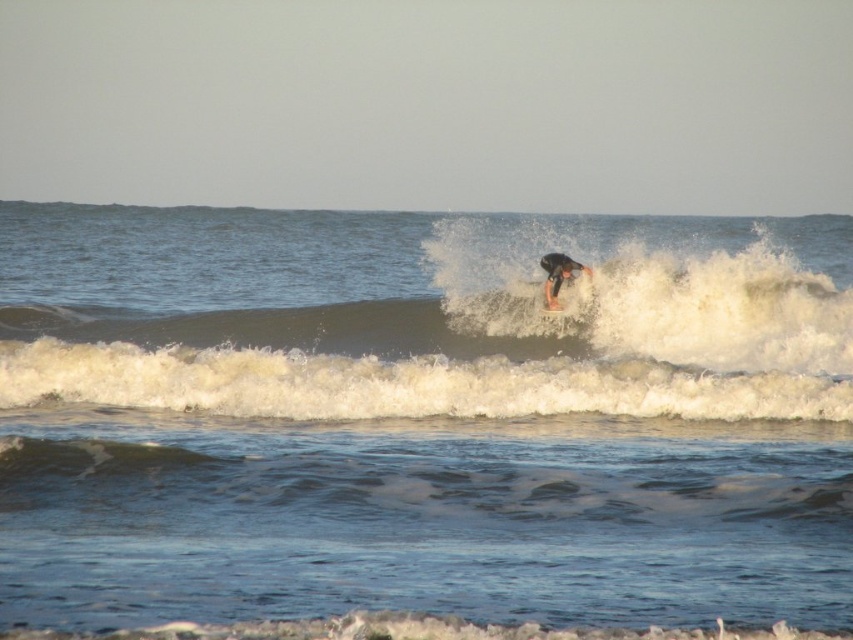
Is clear blue water at wave center positioned in front of white foam surfboard at center?

Yes.

Consider the image. Who is more distant from viewer, (x=543, y=221) or (x=556, y=314)?

The point (x=543, y=221) is behind.

Identify the location of clear blue water at wave center. The height and width of the screenshot is (640, 853). (421, 422).

Which is above, smooth blue wave at center or white foam surfboard at center?

white foam surfboard at center is higher up.

Is point (225, 378) more distant than point (556, 316)?

That is False.

Between point (721, 369) and point (546, 307), which one is positioned behind?

Positioned behind is point (546, 307).

Find the location of `smooth blue wave at center`. smooth blue wave at center is located at coordinates (482, 353).

Does clear blue water at wave center appear on the left side of smooth blue wave at center?

Indeed, clear blue water at wave center is positioned on the left side of smooth blue wave at center.

Is clear blue water at wave center taller than smooth blue wave at center?

Correct, clear blue water at wave center is much taller as smooth blue wave at center.

Image resolution: width=853 pixels, height=640 pixels. Describe the element at coordinates (421, 422) in the screenshot. I see `clear blue water at wave center` at that location.

The height and width of the screenshot is (640, 853). Identify the location of clear blue water at wave center. (421, 422).